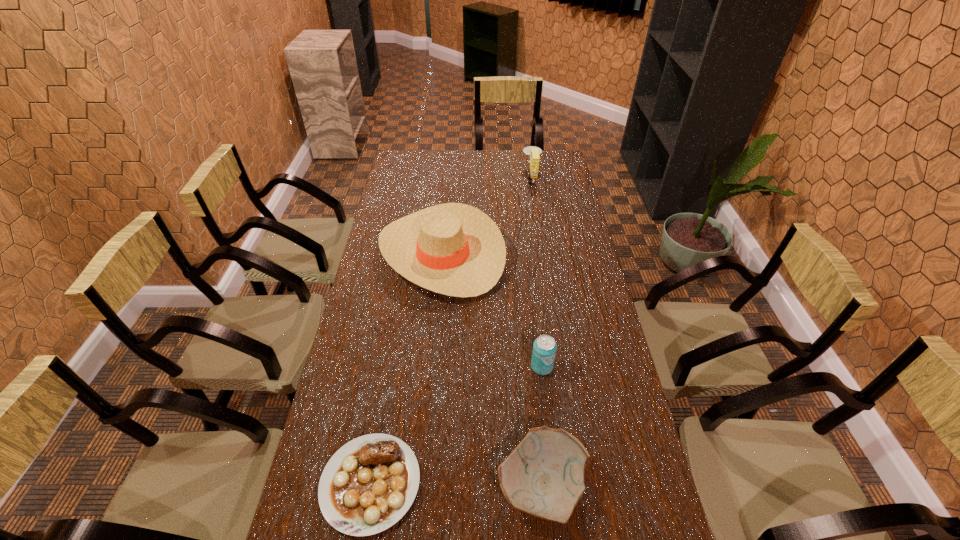
Where is `free point at the left edge`? free point at the left edge is located at coordinates (396, 320).

This screenshot has height=540, width=960. In the image, there is a desktop. What are the coordinates of `vacant space at the right edge` in the screenshot? It's located at (581, 275).

This screenshot has width=960, height=540. In order to click on free space between the second shortest object and the farthest object in this screenshot , I will do coord(537,332).

The image size is (960, 540). What are the coordinates of `vacant region between the farthest object and the steak` in the screenshot? It's located at (451, 330).

Find the location of a particular element. vacant area that lies between the steak and the pottery is located at coordinates (x=456, y=484).

This screenshot has height=540, width=960. I want to click on free spot between the shortest object and the sunhat, so click(406, 368).

I want to click on vacant area that lies between the steak and the third farthest object, so click(x=456, y=425).

The height and width of the screenshot is (540, 960). I want to click on free space between the beer can and the farthest object, so click(537, 272).

Locate an element on the screen. This screenshot has width=960, height=540. free space between the sponge and the steak is located at coordinates (451, 330).

Where is `free spot between the farthest object and the fourth tallest object`? This screenshot has width=960, height=540. free spot between the farthest object and the fourth tallest object is located at coordinates (537, 332).